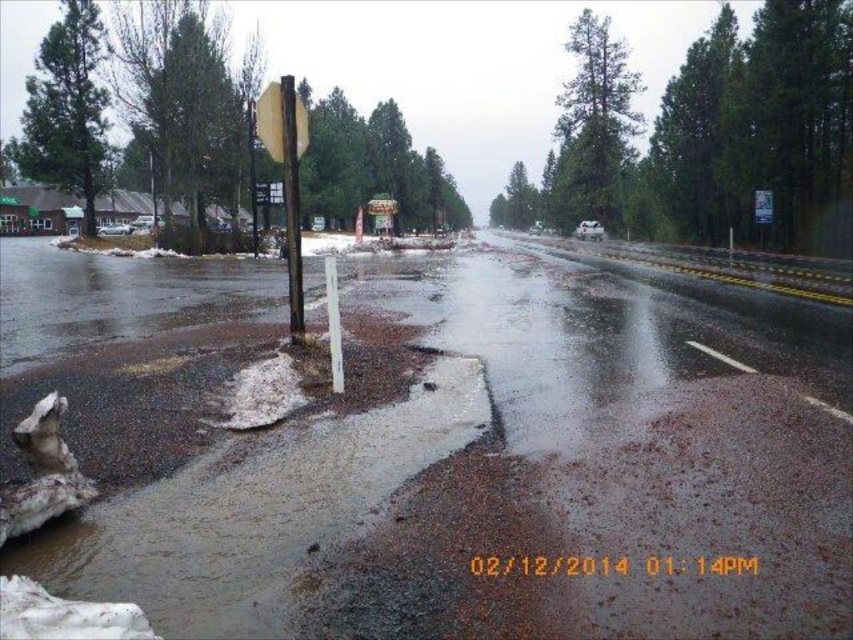
You are a delivery driver who needs to navigate through a narrow alley. The alley is too narrow for two vehicles to pass each other. You see a metallic pole at center and a yellow matte stop sign at upper center. Which object would require more space to avoid while driving through the alley?

The metallic pole at center requires more space to avoid because its width surpasses that of the yellow matte stop sign at upper center.

You are a delivery driver approaching a wet road with a stop sign. You notice brown mud at lower left and a metallic pole at center. Which object is shorter from the ground?

The brown mud at lower left is shorter compared to the metallic pole at center as it has a lesser height.